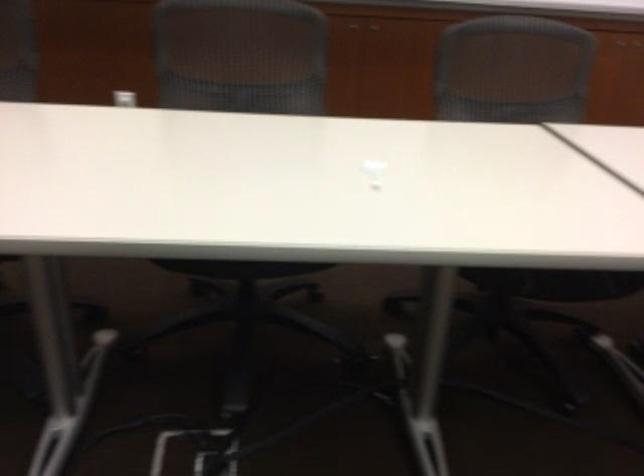
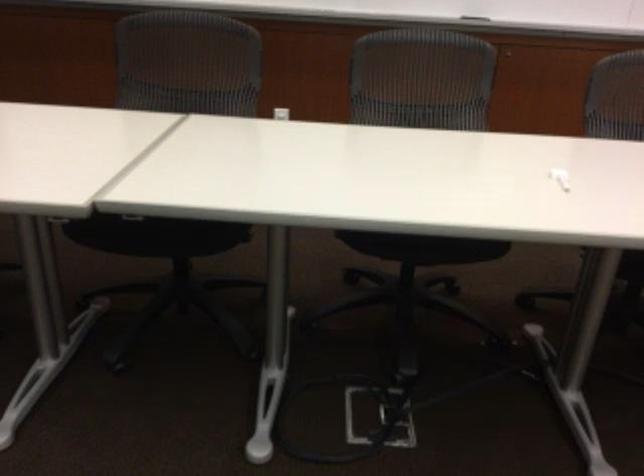
Question: How did the camera likely rotate?

Choices:
 (A) Left
 (B) Right
 (C) Up
 (D) Down

Answer: (A)